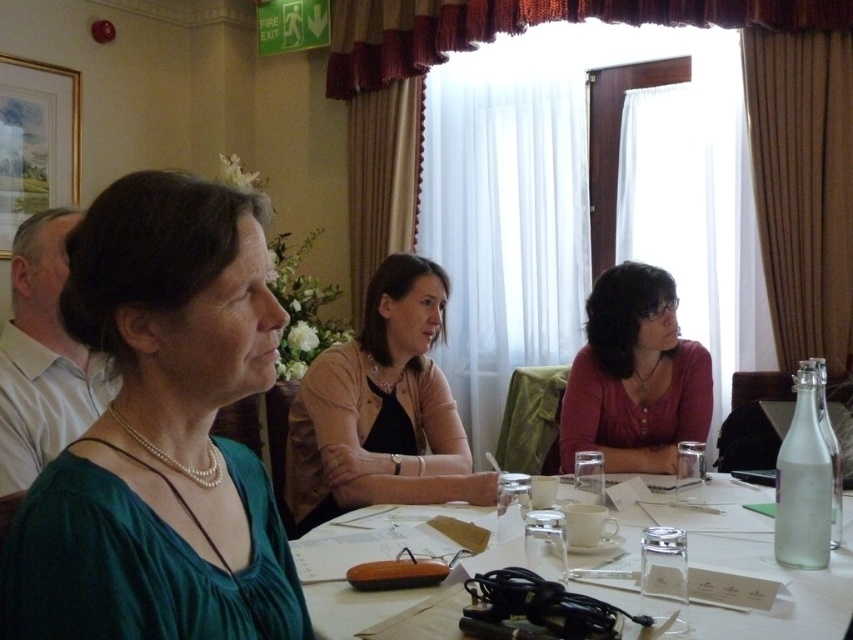
You are a server at a restaurant and need to place a new drink order. You see the clear glass water at center and the clear glass bottle at right. Which one is closer to you?

The clear glass water at center is closer to the viewer than the clear glass bottle at right, so the clear glass water at center is closer to you.

You are organizing a small event and need to choose between the clear glass water at center and the clear glass bottle at right for serving beverages. Based on their sizes, which one can hold more liquid?

The clear glass bottle at right can hold more liquid since it has a greater height than the clear glass water at center.

You are sitting at the table and want to pass a document to the person wearing the pink matte shirt at center. Which direction should you pass it to reach them from the green silk blouse at center?

The green silk blouse at center is to the left of the pink matte shirt at center, so you should pass the document to the right to reach the pink matte shirt at center from the green silk blouse at center.